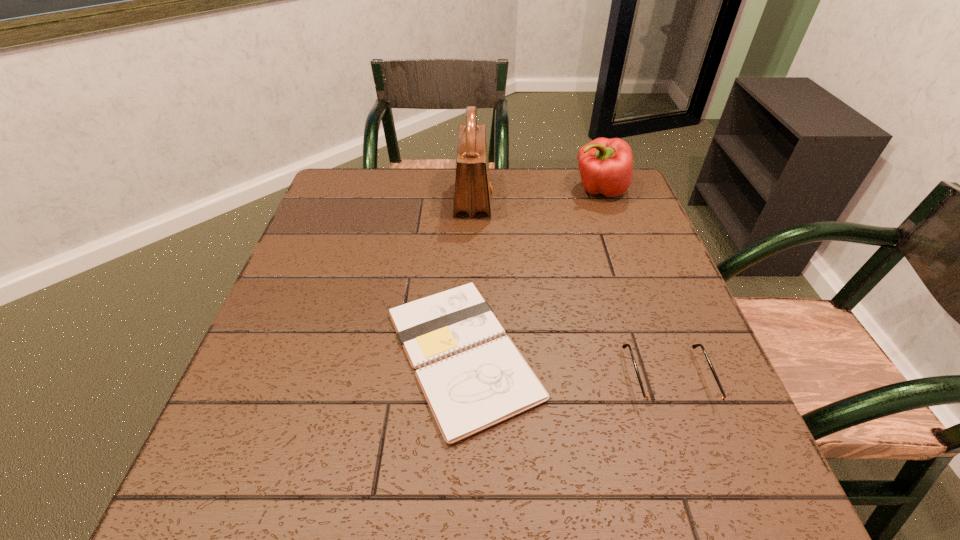
I want to click on object that stands as the second closest to the third shortest object, so (473, 377).

Locate an element on the screen. The image size is (960, 540). blank area in the image that satisfies the following two spatial constraints: 1. on the back side of the third shortest object; 2. on the left side of the notepad is located at coordinates (468, 190).